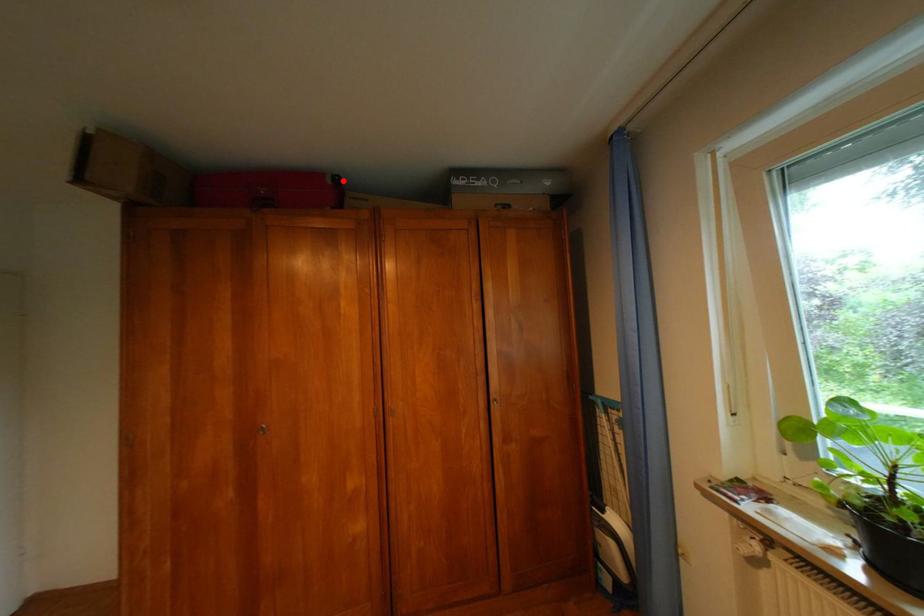
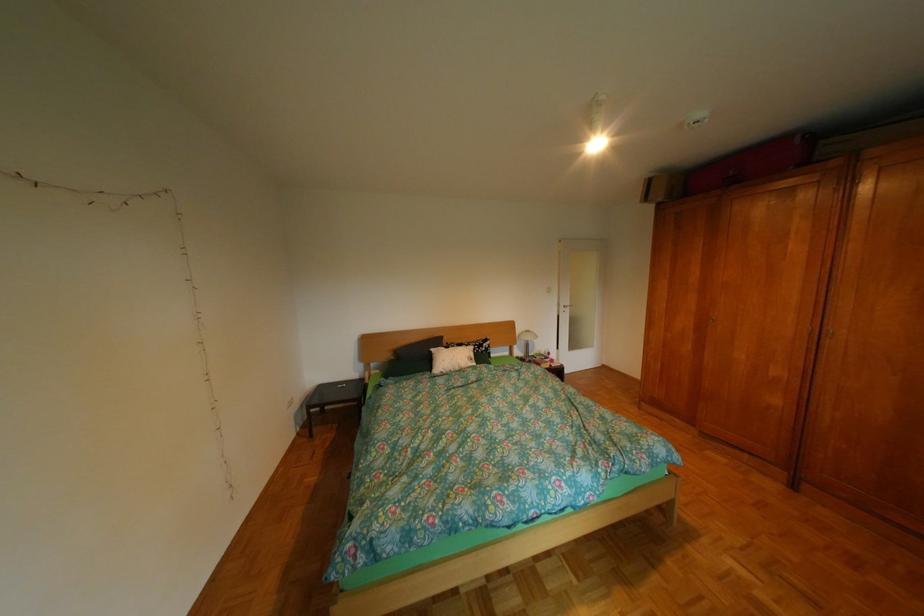
Locate, in the second image, the point that corresponds to the highlighted location in the first image.

(812, 142)